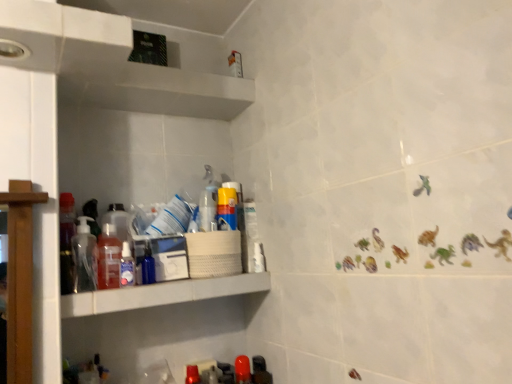
Image resolution: width=512 pixels, height=384 pixels. Describe the element at coordinates (127, 266) in the screenshot. I see `transparent plastic bottle at shelf left, which appears as the fourth bottle when viewed from the left` at that location.

Measure the distance between point [90,238] and camera.

They are 3.61 feet apart.

You are a GUI agent. You are given a task and a screenshot of the screen. Output one action in this format:
    pyautogui.click(x=<x>, y=<y>)
    Task: Click on the white plastic shelf at center
    
    Given the screenshot: What is the action you would take?
    pyautogui.click(x=161, y=294)

Describe the element at coordinates (109, 258) in the screenshot. This screenshot has height=384, width=512. I see `translucent plastic bottle at shelf left, which is counted as the 6th bottle, starting from the right` at that location.

The width and height of the screenshot is (512, 384). Describe the element at coordinates (119, 221) in the screenshot. I see `translucent plastic bottle at shelf left, which ranks as the seventh bottle in right-to-left order` at that location.

The image size is (512, 384). I want to click on glossy plastic bottle at lower center, the 7th bottle viewed from the left, so click(242, 370).

This screenshot has height=384, width=512. What do you see at coordinates (192, 375) in the screenshot?
I see `matte red plastic bottle at lower center, which appears as the 4th bottle when viewed from the right` at bounding box center [192, 375].

The height and width of the screenshot is (384, 512). Identify the location of transparent plastic bottle at shelf left, which appears as the fourth bottle when viewed from the left. (127, 266).

From a real-world perspective, is transparent plastic spray bottle at center, which is counted as the 3th bottle, starting from the right, physically below white plastic shelf at center?

No, from a real-world perspective, transparent plastic spray bottle at center, which is counted as the 3th bottle, starting from the right, is not beneath white plastic shelf at center.

Between transparent plastic spray bottle at center, the sixth bottle in the left-to-right sequence, and white plastic shelf at center, which one has smaller size?

Smaller between the two is transparent plastic spray bottle at center, the sixth bottle in the left-to-right sequence.

From the image's perspective, is transparent plastic spray bottle at center, which is counted as the 3th bottle, starting from the right, above or below white plastic shelf at center?

From the image's perspective, transparent plastic spray bottle at center, which is counted as the 3th bottle, starting from the right, appears above white plastic shelf at center.

Could you tell me if transparent plastic spray bottle at center, the sixth bottle in the left-to-right sequence, is facing white plastic shelf at center?

No, transparent plastic spray bottle at center, the sixth bottle in the left-to-right sequence, is not oriented towards white plastic shelf at center.

Looking at their sizes, would you say matte red plastic bottle at lower center, which appears as the 4th bottle when viewed from the right, is wider or thinner than translucent plastic bottle at shelf left, which ranks as the seventh bottle in right-to-left order?

Considering their sizes, matte red plastic bottle at lower center, which appears as the 4th bottle when viewed from the right, looks slimmer than translucent plastic bottle at shelf left, which ranks as the seventh bottle in right-to-left order.

How different are the orientations of matte red plastic bottle at lower center, positioned as the 5th bottle in left-to-right order, and translucent plastic bottle at shelf left, the 2th bottle in the left-to-right sequence, in degrees?

3.06 degrees separate the facing orientations of matte red plastic bottle at lower center, positioned as the 5th bottle in left-to-right order, and translucent plastic bottle at shelf left, the 2th bottle in the left-to-right sequence.

From the picture: From a real-world perspective, is matte red plastic bottle at lower center, positioned as the 5th bottle in left-to-right order, positioned over translucent plastic bottle at shelf left, which ranks as the seventh bottle in right-to-left order, based on gravity?

Actually, matte red plastic bottle at lower center, positioned as the 5th bottle in left-to-right order, is physically below translucent plastic bottle at shelf left, which ranks as the seventh bottle in right-to-left order, in the real world.

Starting from the matte red plastic bottle at lower center, which appears as the 4th bottle when viewed from the right, which bottle is the 3rd one to the left? Please provide its 2D coordinates.

[(119, 221)]

Are matte black bottle at lower center, the first bottle when ordered from right to left, and transparent plastic spray bottle at center, the sixth bottle in the left-to-right sequence, making contact?

No, matte black bottle at lower center, the first bottle when ordered from right to left, is not next to transparent plastic spray bottle at center, the sixth bottle in the left-to-right sequence.

What's the angular difference between matte black bottle at lower center, the first bottle when ordered from right to left, and transparent plastic spray bottle at center, the sixth bottle in the left-to-right sequence,'s facing directions?

There is a 0.706-degree angle between the facing directions of matte black bottle at lower center, the first bottle when ordered from right to left, and transparent plastic spray bottle at center, the sixth bottle in the left-to-right sequence.

Is matte black bottle at lower center, placed as the eighth bottle when sorted from left to right, aimed at transparent plastic spray bottle at center, the sixth bottle in the left-to-right sequence?

No, matte black bottle at lower center, placed as the eighth bottle when sorted from left to right, is not facing towards transparent plastic spray bottle at center, the sixth bottle in the left-to-right sequence.

Considering the sizes of objects matte black bottle at lower center, the first bottle when ordered from right to left, and transparent plastic spray bottle at center, the sixth bottle in the left-to-right sequence, in the image provided, who is smaller, matte black bottle at lower center, the first bottle when ordered from right to left, or transparent plastic spray bottle at center, the sixth bottle in the left-to-right sequence,?

transparent plastic spray bottle at center, the sixth bottle in the left-to-right sequence.

This screenshot has width=512, height=384. I want to click on the 4th bottle to the right of the translucent plastic bottle at shelf left, acting as the third bottle starting from the left, counting from the anchor's position, so click(x=242, y=370).

Is glossy plastic bottle at lower center, the 7th bottle viewed from the left, far away from translucent plastic bottle at shelf left, acting as the third bottle starting from the left?

No.

Is glossy plastic bottle at lower center, the 7th bottle viewed from the left, positioned in front of translucent plastic bottle at shelf left, acting as the third bottle starting from the left?

No, glossy plastic bottle at lower center, the 7th bottle viewed from the left, is further to the viewer.

From a real-world perspective, which is physically below, glossy plastic bottle at lower center, the 7th bottle viewed from the left, or translucent plastic bottle at shelf left, acting as the third bottle starting from the left?

glossy plastic bottle at lower center, the 7th bottle viewed from the left, from a real-world perspective.

From a real-world perspective, which object stands above the other?

translucent plastic bottle at shelf left, the 2th bottle in the left-to-right sequence, is physically above.

Can you tell me how much translucent plastic bottle at shelf left, which ranks as the seventh bottle in right-to-left order, and white plastic shelf at center differ in facing direction?

translucent plastic bottle at shelf left, which ranks as the seventh bottle in right-to-left order, and white plastic shelf at center are facing 0.00399 degrees away from each other.

Which of these two, translucent plastic bottle at shelf left, the 2th bottle in the left-to-right sequence, or white plastic shelf at center, stands taller?

translucent plastic bottle at shelf left, the 2th bottle in the left-to-right sequence, is taller.

Considering the sizes of objects translucent plastic bottle at shelf left, which is counted as the 6th bottle, starting from the right, and glossy plastic bottle at lower center, which is the second bottle in right-to-left order, in the image provided, who is smaller, translucent plastic bottle at shelf left, which is counted as the 6th bottle, starting from the right, or glossy plastic bottle at lower center, which is the second bottle in right-to-left order,?

glossy plastic bottle at lower center, which is the second bottle in right-to-left order, is smaller.

From the glossy plastic bottle at lower center, which is the second bottle in right-to-left order, count 3rd bottles forward and point to it. Please provide its 2D coordinates.

[(109, 258)]

How far apart are translucent plastic bottle at shelf left, which is counted as the 6th bottle, starting from the right, and glossy plastic bottle at lower center, the 7th bottle viewed from the left?

The distance of translucent plastic bottle at shelf left, which is counted as the 6th bottle, starting from the right, from glossy plastic bottle at lower center, the 7th bottle viewed from the left, is 18.60 inches.

Is translucent plastic bottle at shelf left, acting as the third bottle starting from the left, far from glossy plastic bottle at lower center, the 7th bottle viewed from the left?

No, translucent plastic bottle at shelf left, acting as the third bottle starting from the left, is in close proximity to glossy plastic bottle at lower center, the 7th bottle viewed from the left.

Who is more distant, transparent plastic bottle at shelf left, the 5th bottle when ordered from right to left, or translucent plastic bottle at shelf left, the 2th bottle in the left-to-right sequence?

translucent plastic bottle at shelf left, the 2th bottle in the left-to-right sequence, is further away from the camera.

Is transparent plastic bottle at shelf left, the 5th bottle when ordered from right to left, completely or partially outside of translucent plastic bottle at shelf left, which ranks as the seventh bottle in right-to-left order?

Yes, transparent plastic bottle at shelf left, the 5th bottle when ordered from right to left, is located beyond the bounds of translucent plastic bottle at shelf left, which ranks as the seventh bottle in right-to-left order.

From the image's perspective, does transparent plastic bottle at shelf left, which appears as the fourth bottle when viewed from the left, appear higher than translucent plastic bottle at shelf left, which ranks as the seventh bottle in right-to-left order?

No.

Considering the relative sizes of transparent plastic bottle at shelf left, the 5th bottle when ordered from right to left, and translucent plastic bottle at shelf left, the 2th bottle in the left-to-right sequence, in the image provided, is transparent plastic bottle at shelf left, the 5th bottle when ordered from right to left, wider than translucent plastic bottle at shelf left, the 2th bottle in the left-to-right sequence,?

No.

The height and width of the screenshot is (384, 512). Identify the location of ledge on the left of transparent plastic spray bottle at center, which is counted as the 3th bottle, starting from the right. (161, 294).

The height and width of the screenshot is (384, 512). Identify the location of the 3rd bottle counting from the right side of the translucent plastic bottle at shelf left, which ranks as the seventh bottle in right-to-left order. (192, 375).

Estimate the real-world distances between objects in this image. Which object is further from transparent plastic bottle at shelf left, which appears as the fourth bottle when viewed from the left, glossy plastic bottle at lower center, the 7th bottle viewed from the left, or translucent plastic bottle at shelf left, which is counted as the 6th bottle, starting from the right?

Based on the image, glossy plastic bottle at lower center, the 7th bottle viewed from the left, appears to be further to transparent plastic bottle at shelf left, which appears as the fourth bottle when viewed from the left.

Considering their positions, is transparent plastic spray bottle at center, which is counted as the 3th bottle, starting from the right, positioned closer to translucent plastic soap dispenser at left, the first bottle from the left, than translucent plastic bottle at shelf left, which is counted as the 6th bottle, starting from the right?

Among the two, translucent plastic bottle at shelf left, which is counted as the 6th bottle, starting from the right, is located nearer to translucent plastic soap dispenser at left, the first bottle from the left.

From the image, which object appears to be nearer to translucent plastic soap dispenser at left, the first bottle from the left, glossy plastic bottle at lower center, the 7th bottle viewed from the left, or matte black bottle at lower center, the first bottle when ordered from right to left?

glossy plastic bottle at lower center, the 7th bottle viewed from the left.

Based on their spatial positions, is transparent plastic spray bottle at center, the sixth bottle in the left-to-right sequence, or translucent plastic bottle at shelf left, which ranks as the seventh bottle in right-to-left order, closer to translucent plastic bottle at shelf left, which is counted as the 6th bottle, starting from the right?

translucent plastic bottle at shelf left, which ranks as the seventh bottle in right-to-left order.

From the image, which object appears to be nearer to translucent plastic bottle at shelf left, acting as the third bottle starting from the left, glossy plastic bottle at lower center, which is the second bottle in right-to-left order, or white plastic shelf at center?

white plastic shelf at center.

In the scene shown: Estimate the real-world distances between objects in this image. Which object is closer to translucent plastic bottle at shelf left, acting as the third bottle starting from the left, glossy plastic bottle at lower center, the 7th bottle viewed from the left, or translucent plastic bottle at shelf left, which ranks as the seventh bottle in right-to-left order?

translucent plastic bottle at shelf left, which ranks as the seventh bottle in right-to-left order, lies closer to translucent plastic bottle at shelf left, acting as the third bottle starting from the left, than the other object.

Based on their spatial positions, is transparent plastic bottle at shelf left, which appears as the fourth bottle when viewed from the left, or translucent plastic bottle at shelf left, which ranks as the seventh bottle in right-to-left order, closer to glossy plastic bottle at lower center, which is the second bottle in right-to-left order?

transparent plastic bottle at shelf left, which appears as the fourth bottle when viewed from the left, is positioned closer to the anchor glossy plastic bottle at lower center, which is the second bottle in right-to-left order.

Considering their positions, is transparent plastic spray bottle at center, the sixth bottle in the left-to-right sequence, positioned further to translucent plastic soap dispenser at left, the eighth bottle from the right, than glossy plastic bottle at lower center, the 7th bottle viewed from the left?

glossy plastic bottle at lower center, the 7th bottle viewed from the left.

Find the location of a particular element. ledge between translucent plastic bottle at shelf left, the 2th bottle in the left-to-right sequence, and matte black bottle at lower center, placed as the eighth bottle when sorted from left to right, vertically is located at coordinates (161, 294).

Where is `bottle between translucent plastic bottle at shelf left, which is counted as the 6th bottle, starting from the right, and translucent plastic bottle at shelf left, which ranks as the seventh bottle in right-to-left order, in the front-back direction`? This screenshot has height=384, width=512. bottle between translucent plastic bottle at shelf left, which is counted as the 6th bottle, starting from the right, and translucent plastic bottle at shelf left, which ranks as the seventh bottle in right-to-left order, in the front-back direction is located at coordinates (127, 266).

Locate an element on the screen. bottle between transparent plastic bottle at shelf left, which appears as the fourth bottle when viewed from the left, and matte black bottle at lower center, placed as the eighth bottle when sorted from left to right, in the up-down direction is located at coordinates (242, 370).

You are a GUI agent. You are given a task and a screenshot of the screen. Output one action in this format:
    pyautogui.click(x=<x>, y=<y>)
    Task: Click on the bottle between translucent plastic bottle at shelf left, which is counted as the 6th bottle, starting from the right, and white plastic shelf at center
    Image resolution: width=512 pixels, height=384 pixels.
    Given the screenshot: What is the action you would take?
    pyautogui.click(x=127, y=266)